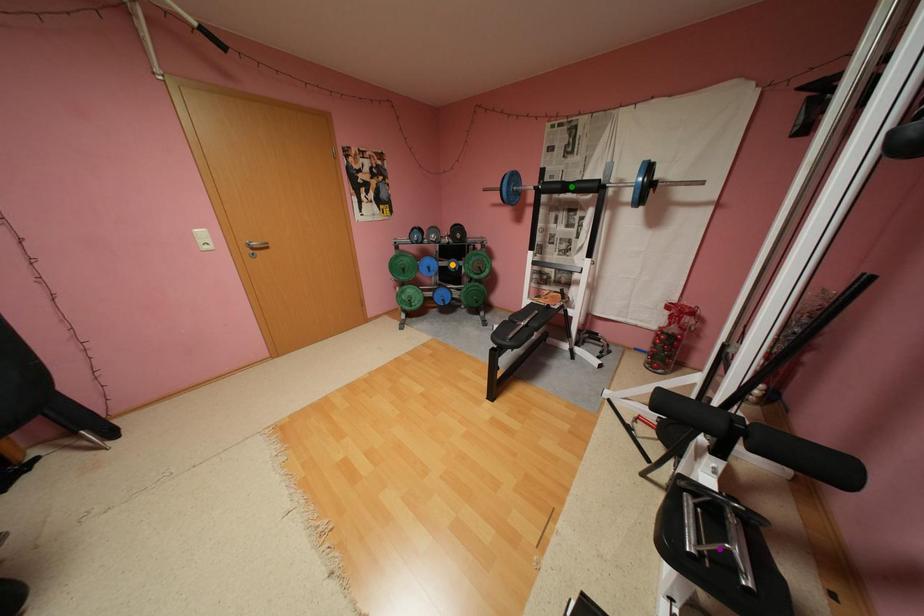
Order these from nearest to farthest:
- purple point
- green point
- orange point

purple point
green point
orange point